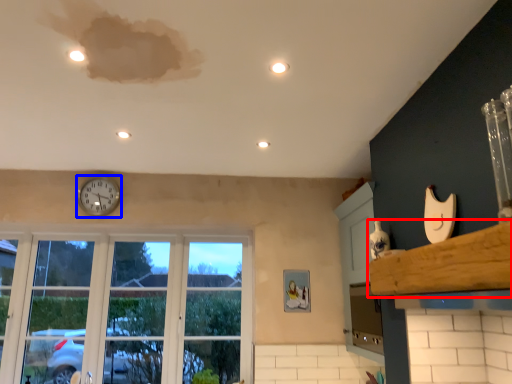
Question: Which object is further to the camera taking this photo, window sill (highlighted by a red box) or clock (highlighted by a blue box)?

Choices:
 (A) window sill
 (B) clock

Answer: (B)